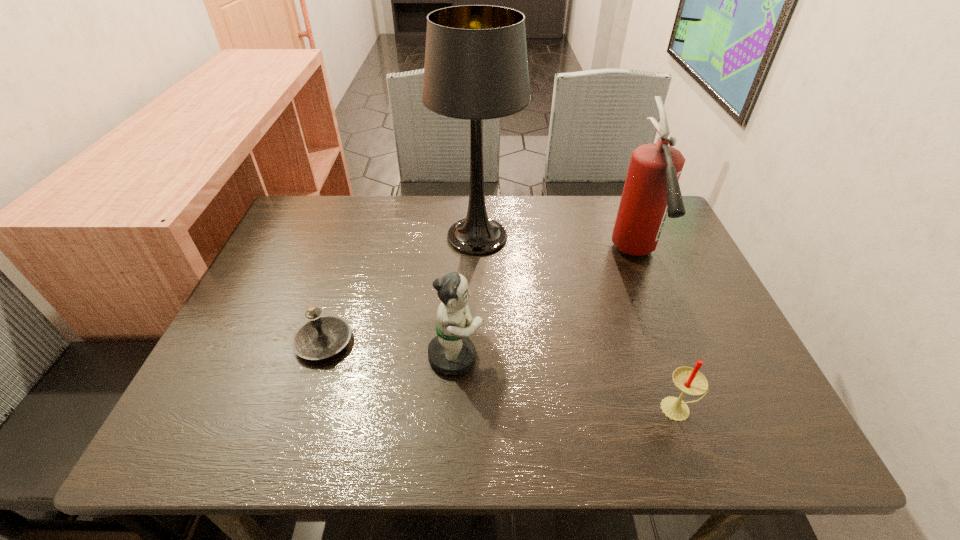
Where is `the tallest object`? Image resolution: width=960 pixels, height=540 pixels. the tallest object is located at coordinates [476, 68].

Image resolution: width=960 pixels, height=540 pixels. I want to click on the second tallest object, so click(651, 191).

Identify the location of the third shortest object. (451, 352).

The width and height of the screenshot is (960, 540). I want to click on the nearer candle, so click(x=690, y=381).

The height and width of the screenshot is (540, 960). In order to click on the right candle in this screenshot , I will do `click(690, 381)`.

Identify the location of the shortest object. This screenshot has width=960, height=540. (321, 336).

I want to click on the farther candle, so click(321, 336).

Find the location of `vacant space situated on the front of the table lamp`. vacant space situated on the front of the table lamp is located at coordinates (476, 310).

Where is `blank area located 0.360m at the nozzle of the fire extinguisher`? The width and height of the screenshot is (960, 540). blank area located 0.360m at the nozzle of the fire extinguisher is located at coordinates [x=705, y=433].

Locate an element on the screen. Image resolution: width=960 pixels, height=540 pixels. vacant area located 0.190m on the front-facing side of the third tallest object is located at coordinates (573, 356).